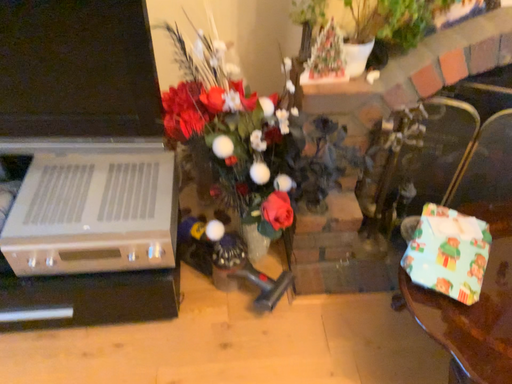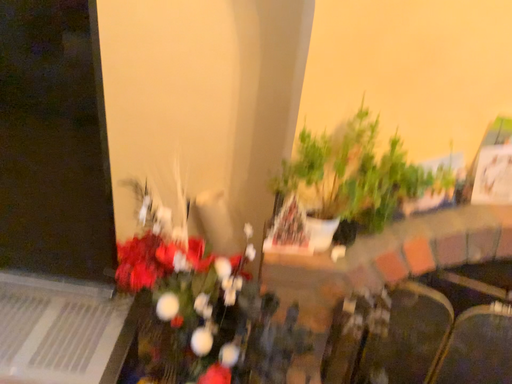
Question: How did the camera likely rotate when shooting the video?

Choices:
 (A) rotated downward
 (B) rotated upward

Answer: (B)